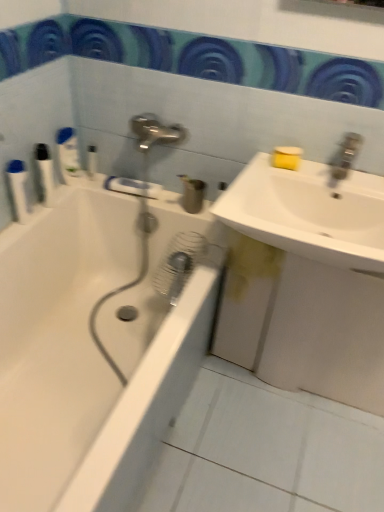
At what (x,y) coordinates should I click in order to perform the action: click on vacant area that lies between white plastic towel bar at upper center and white plastic bottle at upper left, the third toiletry when ordered from left to right. Please return your answer as a coordinate pair (x, y). The height and width of the screenshot is (512, 384). Looking at the image, I should click on (105, 187).